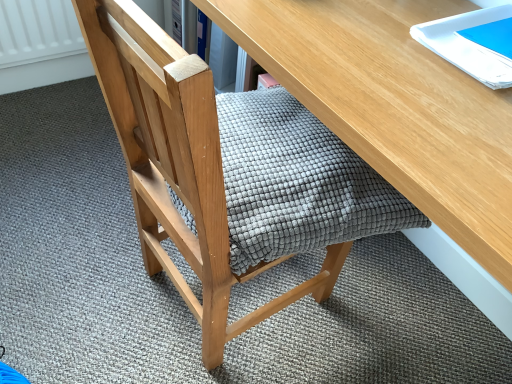
Where is `vacant region to the left of white glossy notebook at upper right`? vacant region to the left of white glossy notebook at upper right is located at coordinates (367, 41).